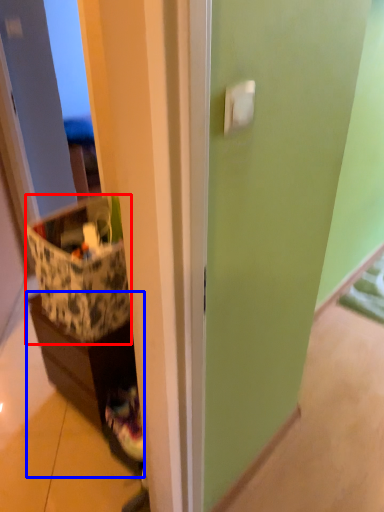
Question: Which object is closer to the camera taking this photo, storage box (highlighted by a red box) or cabinetry (highlighted by a blue box)?

Choices:
 (A) storage box
 (B) cabinetry

Answer: (A)